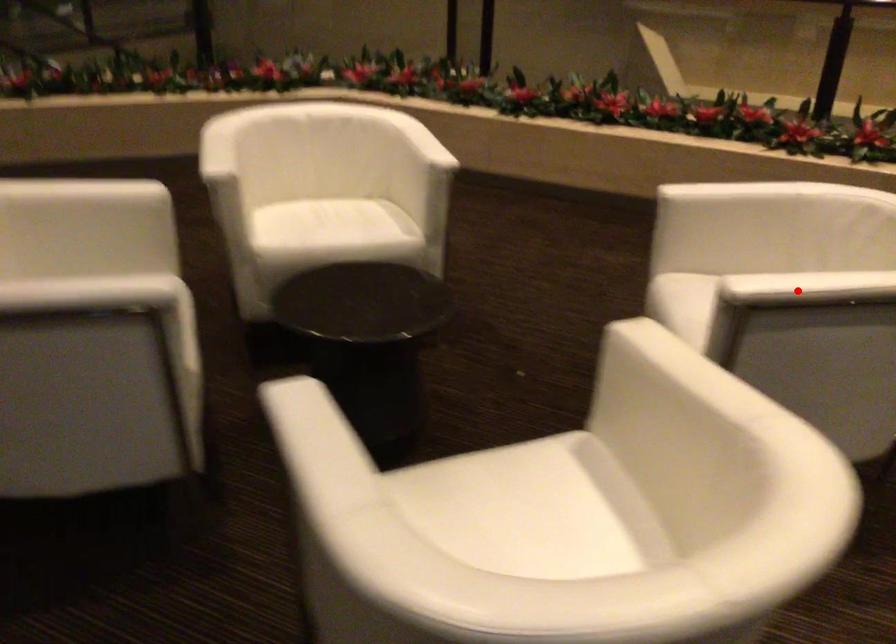
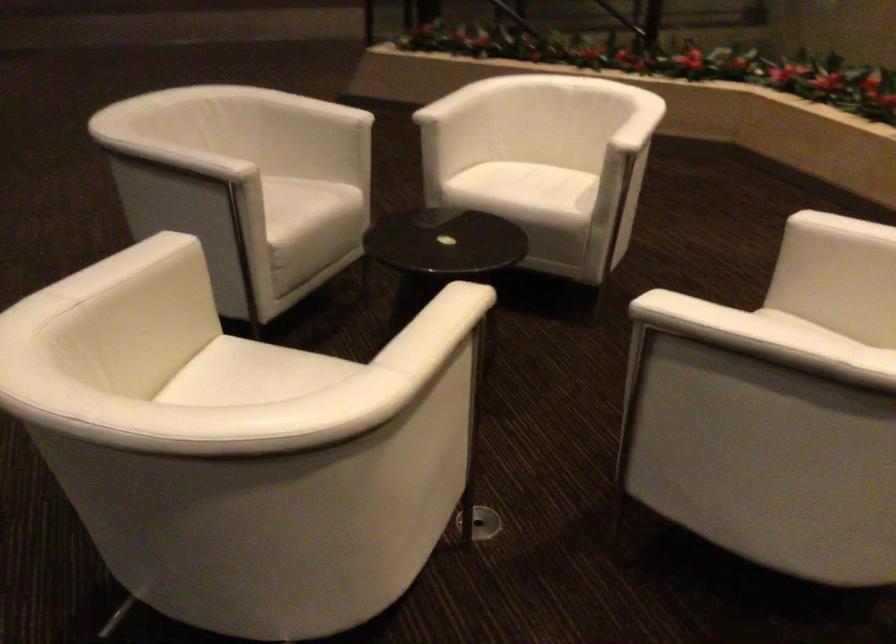
Find the pixel in the second image that matches the highlighted location in the first image.

(694, 317)